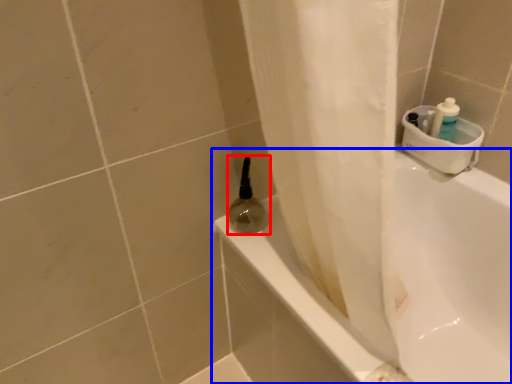
Question: Which object is further to the camera taking this photo, mouthwash (highlighted by a red box) or bathtub (highlighted by a blue box)?

Choices:
 (A) mouthwash
 (B) bathtub

Answer: (A)